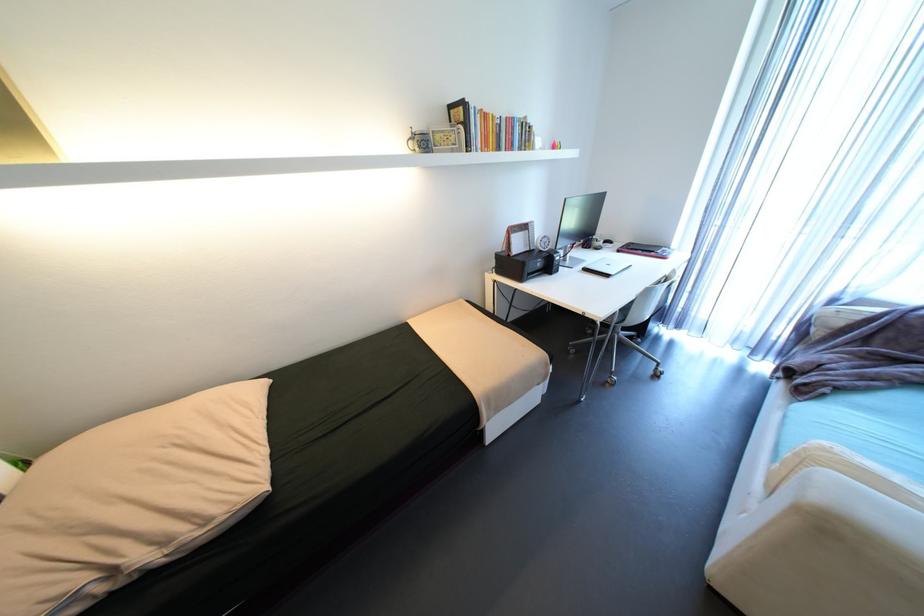
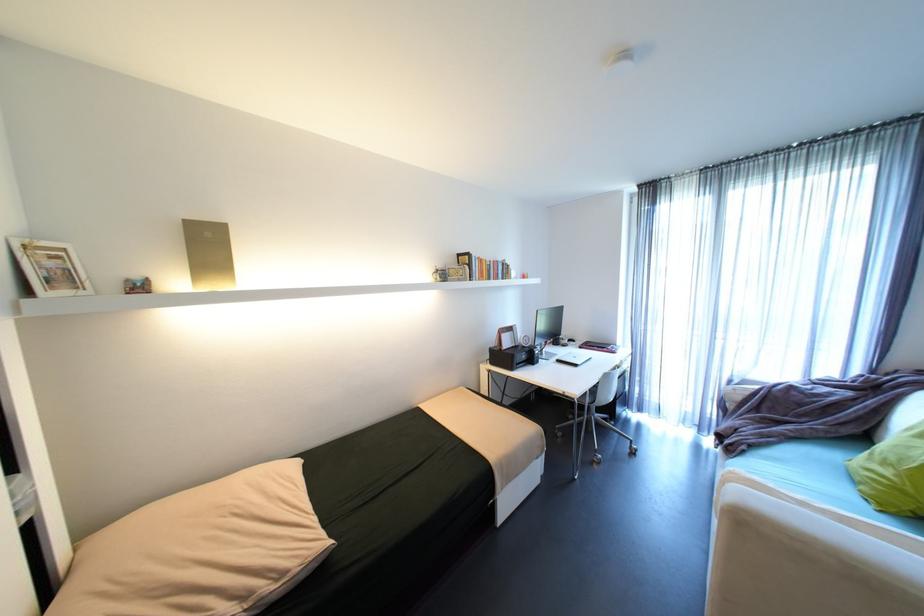
Where in the second image is the point corresponding to point 587,272 from the first image?

(562, 363)